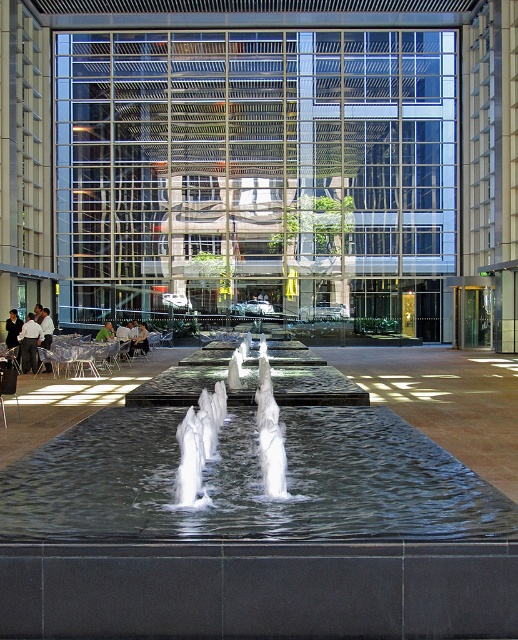
Question: Is clear water jets at center bigger than white shirt at left?

Choices:
 (A) no
 (B) yes

Answer: (B)

Question: Can you confirm if clear water jets at center is positioned to the left of white shirt at left?

Choices:
 (A) yes
 (B) no

Answer: (B)

Question: Which point is farther from the camera taking this photo?

Choices:
 (A) (308, 449)
 (B) (32, 324)
 (C) (276, 451)

Answer: (B)

Question: Which object appears farthest from the camera in this image?

Choices:
 (A) white shirt at left
 (B) clear water jets at center
 (C) clear water at center

Answer: (A)

Question: Does clear water at center have a larger size compared to white shirt at left?

Choices:
 (A) no
 (B) yes

Answer: (A)

Question: Which object is farther from the camera taking this photo?

Choices:
 (A) clear water jets at center
 (B) white shirt at left
 (C) clear water at center

Answer: (B)